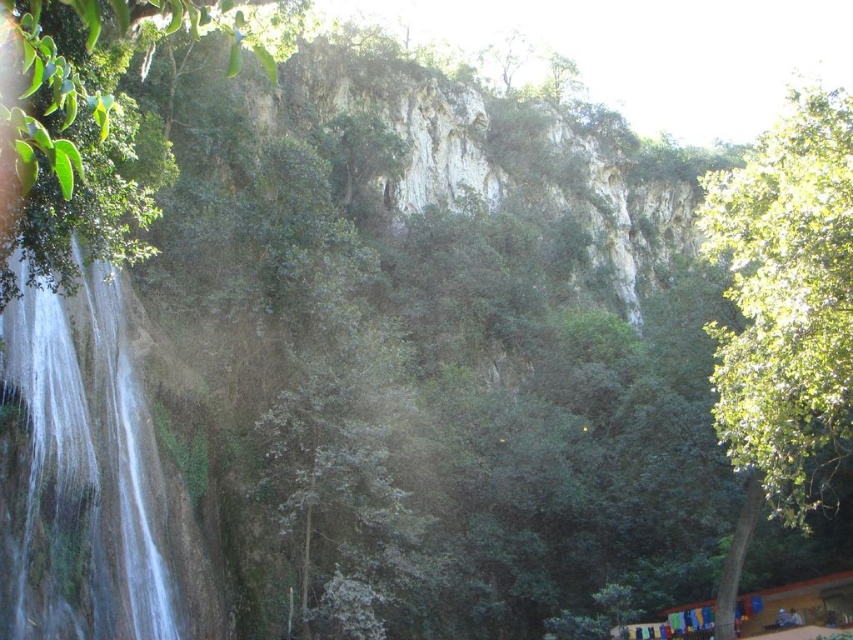
You are standing at the center of the image and want to locate the green leafy tree at right. According to the coordinates provided, in which direction should you look to find it?

The green leafy tree at right is located at coordinates point [786,301], which means it is positioned to the right and slightly upwards from the center of the image. You should look to your right and slightly upwards to locate it.

You are standing in the lush landscape and want to take a photo of both the point at coordinates point (776, 168) and point (12, 17). Which point is closer to your camera when you take the photo?

Point (12, 17) is closer to the camera than point (776, 168) because the description states that point (776, 168) is further to the camera than point (12, 17).

You are a hiker who wants to take a photo of the white smooth waterfall at left from the green leafy tree at right. Is the tree positioned in a way that you can see the waterfall clearly from there?

The green leafy tree at right is located above the white smooth waterfall at left, so yes, you can see the waterfall clearly from the tree as it is positioned higher up.